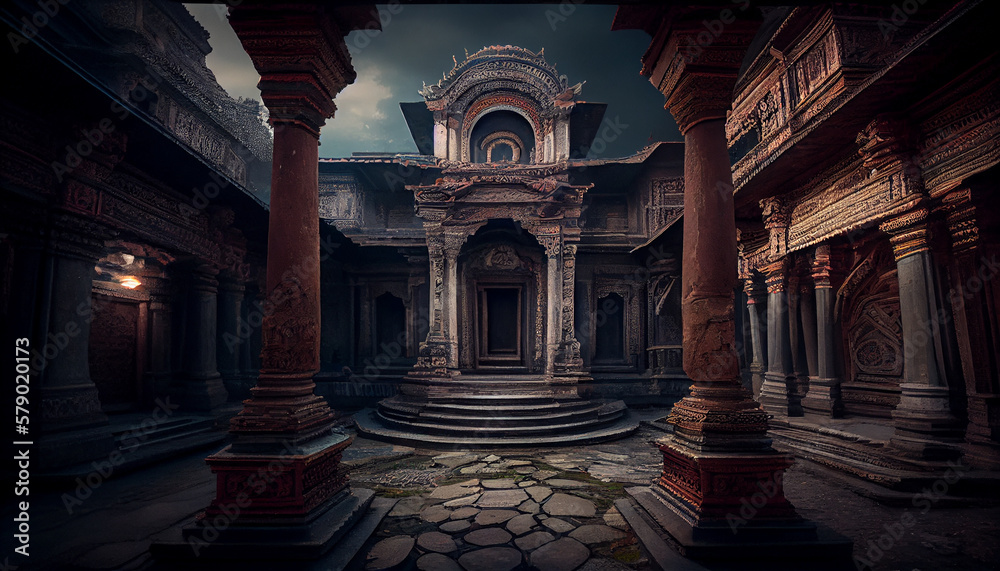
Find the location of a particular element. This screenshot has width=1000, height=571. columns on left side is located at coordinates (75, 339), (205, 325), (237, 325).